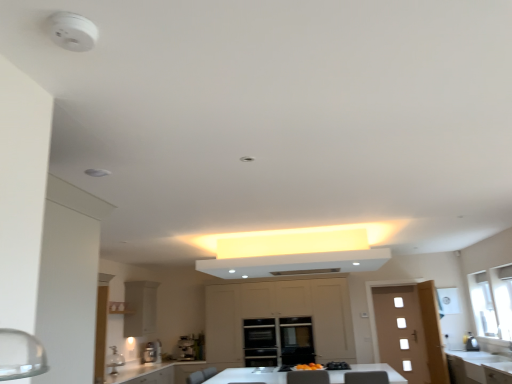
Question: Based on their sizes in the image, would you say transparent glass window at right is bigger or smaller than matte beige cabinetry at center, which is the 1th cabinetry from right to left?

Choices:
 (A) small
 (B) big

Answer: (A)

Question: Visually, is transparent glass window at right positioned to the left or to the right of matte beige cabinetry at center, which is the 1th cabinetry from right to left?

Choices:
 (A) right
 (B) left

Answer: (A)

Question: Considering the real-world distances, which object is closest to the white glossy exhaust hood at center?

Choices:
 (A) transparent glass window at right
 (B) satin silver coffee machine at lower center, acting as the 1th coffee machine starting from the right
 (C) wooden door at right
 (D) white matte cabinet at center, the first cabinetry when ordered from left to right
 (E) satin silver kettle at right

Answer: (C)

Question: Which of these objects is positioned closest to the white glossy exhaust hood at center?

Choices:
 (A) white glossy countertop at center, positioned as the second countertop in right-to-left order
 (B) white glossy countertop at lower right, positioned as the 1th countertop in right-to-left order
 (C) satin silver kettle at right
 (D) satin silver coffee machine at lower center, acting as the 1th coffee machine starting from the right
 (E) matte beige cabinetry at center, the 2th cabinetry in the left-to-right sequence

Answer: (B)